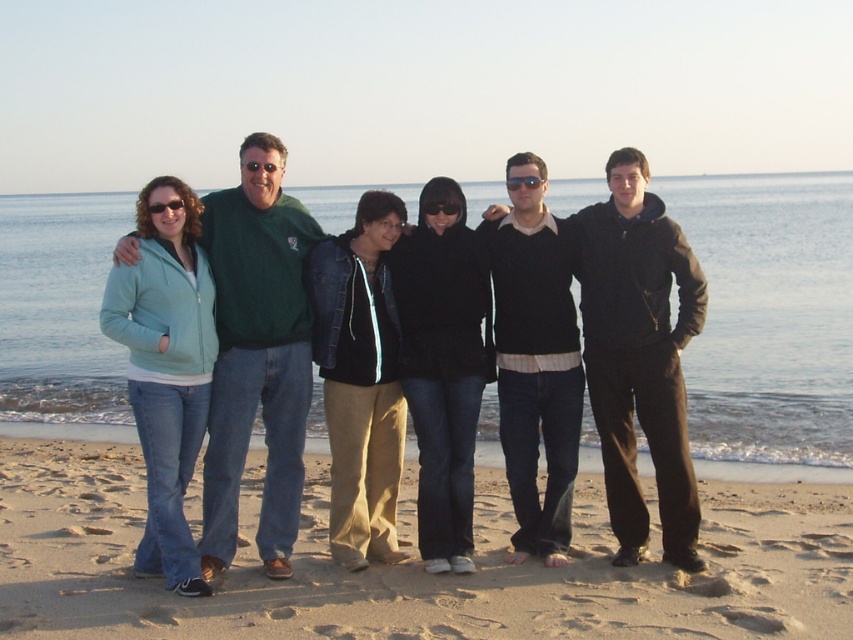
You are standing on the beach and see the sandy brown sand at lower center and the dark brown sweater at center. Which object is located to the left of the other?

The sandy brown sand at lower center is positioned on the left side of dark brown sweater at center.

You are a photographer positioned at the front of the group. You want to take a photo that includes both the matte green sweater at center and the dark brown sweater at center. Which sweater will appear larger in the photo?

The matte green sweater at center will appear larger in the photo because it is closer to the viewer than the dark brown sweater at center.

You are standing on the beach and see two people wearing sweaters. The first person is wearing a green sweater at center, and the second is wearing a dark brown sweater at center. Which sweater is positioned more to the left?

The green sweater at center is positioned more to the left than the dark brown sweater at center.